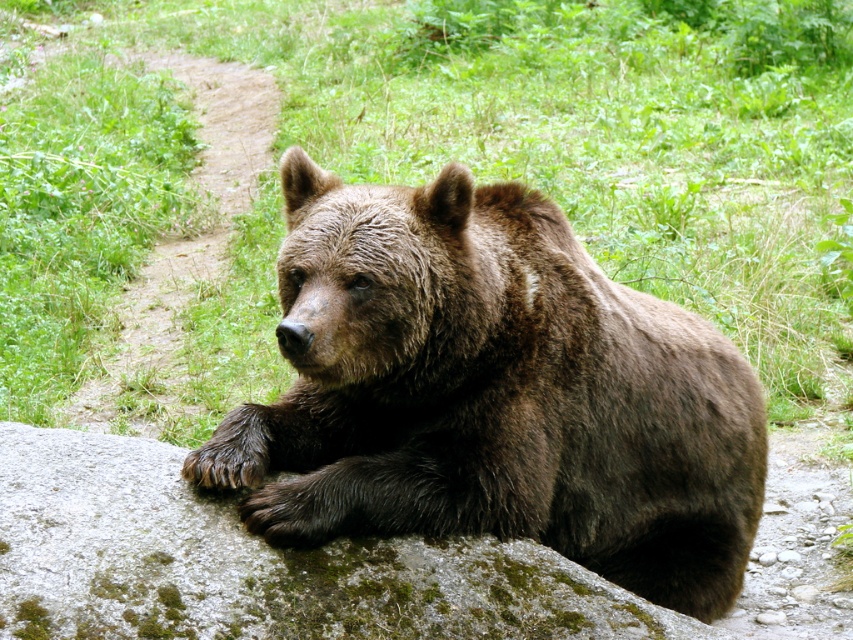
You are a hiker who wants to take a photo of the brown furry bear at center and the green mossy rock at center. To ensure both fit in the frame, you need to know which is wider. Which one is wider?

The green mossy rock at center is wider than the brown furry bear at center.

You are standing at a point and want to approach the large brown bear resting on the mossy rock. The point you are currently at is located at coordinates point (x=236, y=422). Can you safely walk towards the bear from this point without getting too close?

The distance between point (x=236, y=422) and the viewer is 3.82 meters. Since this distance is sufficient, you can safely walk towards the bear from this point without getting too close as long as you maintain a safe distance.

You are a hiker who has spotted the brown furry bear at center and the green mossy rock at center in the distance. From your vantage point, which object is positioned to the right side?

The brown furry bear at center is positioned to the right of the green mossy rock at center, so the brown furry bear at center is on the right side.